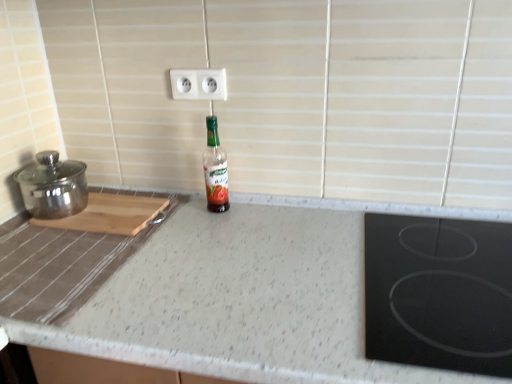
Question: From a real-world perspective, does polished stainless steel pot at left stand above green glass bottle at center?

Choices:
 (A) yes
 (B) no

Answer: (B)

Question: Does polished stainless steel pot at left have a lesser height compared to green glass bottle at center?

Choices:
 (A) no
 (B) yes

Answer: (B)

Question: Does polished stainless steel pot at left appear on the right side of green glass bottle at center?

Choices:
 (A) yes
 (B) no

Answer: (B)

Question: Is polished stainless steel pot at left positioned far away from green glass bottle at center?

Choices:
 (A) yes
 (B) no

Answer: (B)

Question: Is polished stainless steel pot at left bigger than green glass bottle at center?

Choices:
 (A) no
 (B) yes

Answer: (B)

Question: Is speckled granite countertop at center to the left or to the right of wooden cutting board at left in the image?

Choices:
 (A) left
 (B) right

Answer: (B)

Question: Considering the positions of speckled granite countertop at center and wooden cutting board at left in the image, is speckled granite countertop at center bigger or smaller than wooden cutting board at left?

Choices:
 (A) small
 (B) big

Answer: (B)

Question: From the image's perspective, is speckled granite countertop at center located above or below wooden cutting board at left?

Choices:
 (A) below
 (B) above

Answer: (A)

Question: In terms of width, does speckled granite countertop at center look wider or thinner when compared to wooden cutting board at left?

Choices:
 (A) thin
 (B) wide

Answer: (B)

Question: In terms of size, does white plastic electric outlet at upper center appear bigger or smaller than polished stainless steel pot at left?

Choices:
 (A) small
 (B) big

Answer: (A)

Question: Considering the positions of point (177, 84) and point (16, 170), is point (177, 84) closer or farther from the camera than point (16, 170)?

Choices:
 (A) closer
 (B) farther

Answer: (B)

Question: From the image's perspective, is white plastic electric outlet at upper center positioned above or below polished stainless steel pot at left?

Choices:
 (A) above
 (B) below

Answer: (A)

Question: In terms of width, does white plastic electric outlet at upper center look wider or thinner when compared to polished stainless steel pot at left?

Choices:
 (A) wide
 (B) thin

Answer: (B)

Question: Would you say black glass cooktop at right is inside or outside polished stainless steel pot at left?

Choices:
 (A) outside
 (B) inside

Answer: (A)

Question: Looking at the image, does black glass cooktop at right seem bigger or smaller compared to polished stainless steel pot at left?

Choices:
 (A) big
 (B) small

Answer: (A)